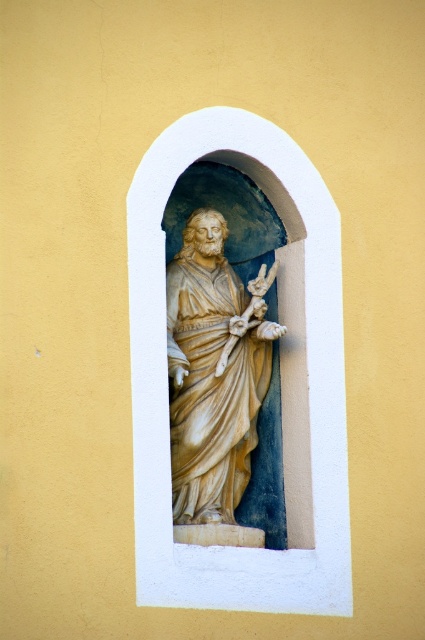
Consider the image. Is white stone statue at center taller than gold textured crucifix at center?

Yes.

Does white stone statue at center lie in front of gold textured crucifix at center?

Yes, it is.

Is point (149, 157) behind point (244, 314)?

No, (149, 157) is closer to viewer.

Find the location of a particular element. white stone statue at center is located at coordinates 308,387.

Can you confirm if white stone statue at center is positioned below beige marble statue at center?

No.

Is point (161, 168) farther from viewer compared to point (266, 436)?

No, it is not.

Locate an element on the screen. white stone statue at center is located at coordinates (308, 387).

Can you confirm if beige marble statue at center is shorter than gold textured crucifix at center?

No, beige marble statue at center is not shorter than gold textured crucifix at center.

Does beige marble statue at center have a smaller size compared to gold textured crucifix at center?

Actually, beige marble statue at center might be larger than gold textured crucifix at center.

Describe the element at coordinates (214, 371) in the screenshot. This screenshot has height=640, width=425. I see `beige marble statue at center` at that location.

Locate an element on the screen. The image size is (425, 640). beige marble statue at center is located at coordinates (214, 371).